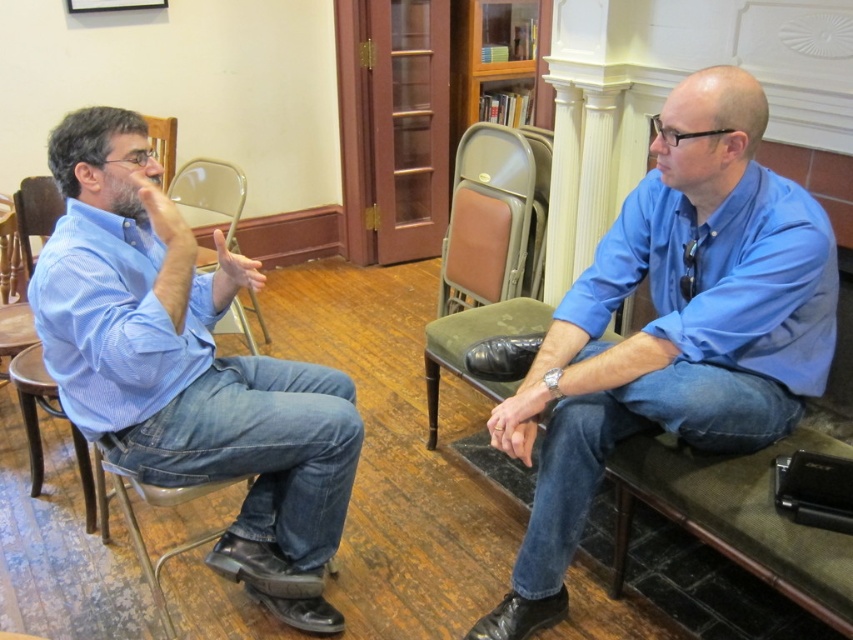
In the scene shown: You are standing in the room and want to hand a document to the person wearing the blue cotton shirt at right. Which direction should you move to approach them?

Since the blue cotton shirt at right is located at point (672, 328), you should move towards the right side of the room to approach the person wearing the blue cotton shirt at right.

You are an interior designer assessing the layout of this room. You need to ensure that all furniture is at least 1.2 meters tall to meet accessibility standards. The blue striped shirt at left and the transparent plastic chair at center are both in the room. Which of these items might not meet the height requirement?

The transparent plastic chair at center might not meet the height requirement because the blue striped shirt at left is taller than it, and if the shirt is taller than 1.2 meters, the chair would be shorter than that. However, without knowing the exact height of the shirt, we can only infer the chair is shorter than the shirt.

You are a photographer setting up a shoot in this room. You need to position a light source to the left of both the blue cotton shirt at right and the blue striped shirt at left. Is this possible?

The blue cotton shirt at right is to the right of the blue striped shirt at left. Therefore, placing a light source to the left of both would require positioning it to the left of the blue striped shirt at left, which is the leftmost item. This is possible as there is space to the left of the blue striped shirt at left.